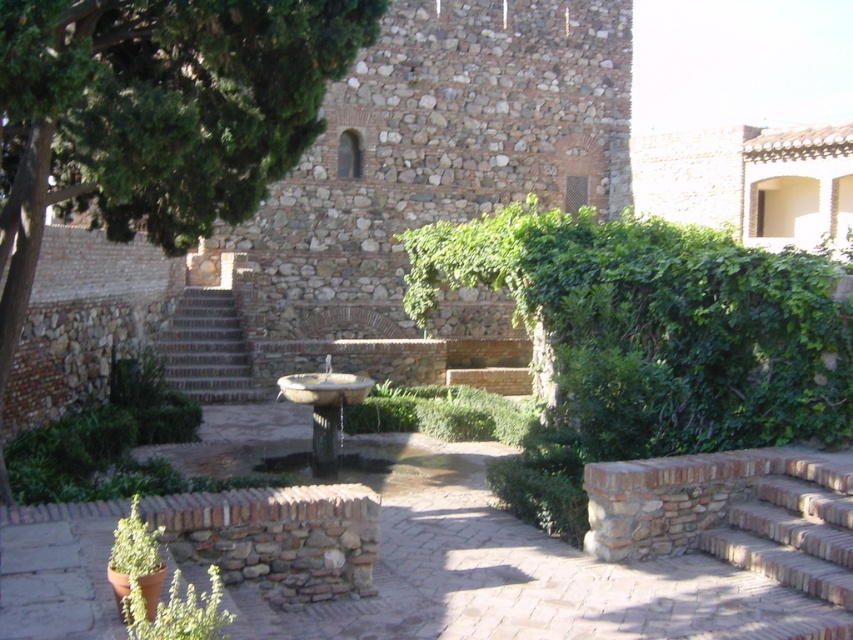
Consider the image. You are standing in the courtyard and want to find the green leafy tree at upper left. According to the 2D coordinates provided, what are its exact coordinates?

The green leafy tree at upper left is located at coordinates point (155, 115).

You are standing in the courtyard and want to walk from the tree on the left to the fountain in the center. There are two points marked on the path. The first point is at coordinates point (186, 307) and the second point is at point (325, 374). Which point should you step on first to reach the fountain?

You should step on point (325, 374) first because point (186, 307) is behind it, meaning the second point is closer to your starting position near the tree on the left.

You are standing in the courtyard and want to take a photo of the green leafy tree at upper left and the brown stone stairs at center. Which object should you focus on first if you want to capture both in one frame without moving the camera?

The green leafy tree at upper left is located above the brown stone stairs at center, so you should focus on the green leafy tree at upper left first to ensure both are in the frame.